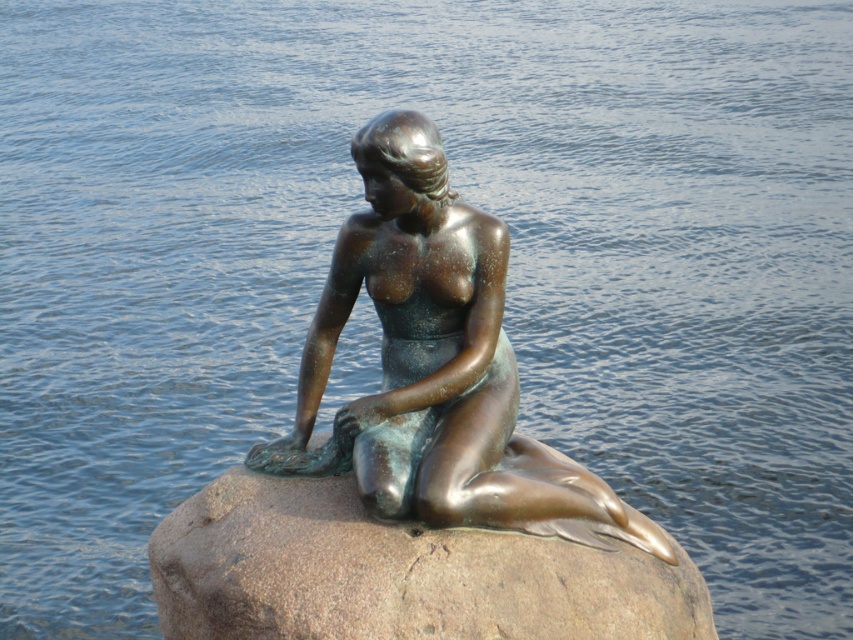
You are a sculptor who wants to place a new small seashell sculpture on the brown granite rock at center without covering the bronze statue at center. Where should you place the seashell?

The bronze statue at center is located above the brown granite rock at center, so you should place the seashell on the lower part of the brown granite rock at center to avoid covering the bronze statue at center.

You are standing in front of the image and want to locate the bronze statue at center. What are the coordinates of its position?

The bronze statue at center is located at coordinates [436,365].

You are an art curator planning to display the bronze statue at center and the brown granite rock at center in an exhibition. Based on the image, which object is taller and should be placed on a higher pedestal to maintain visual balance?

The bronze statue at center is taller than the brown granite rock at center, so it should be placed on a higher pedestal to maintain visual balance.